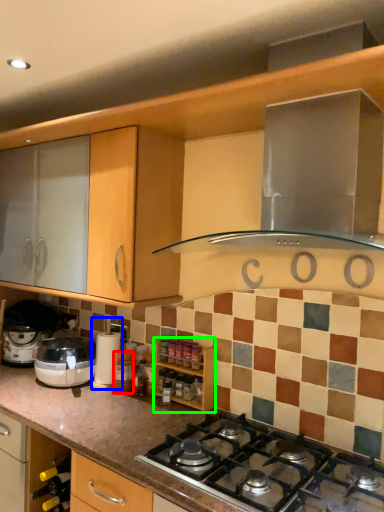
Question: Which is farther away from bottle (highlighted by a red box)? coffee machine (highlighted by a blue box) or cabinetry (highlighted by a green box)?

Choices:
 (A) coffee machine
 (B) cabinetry

Answer: (B)